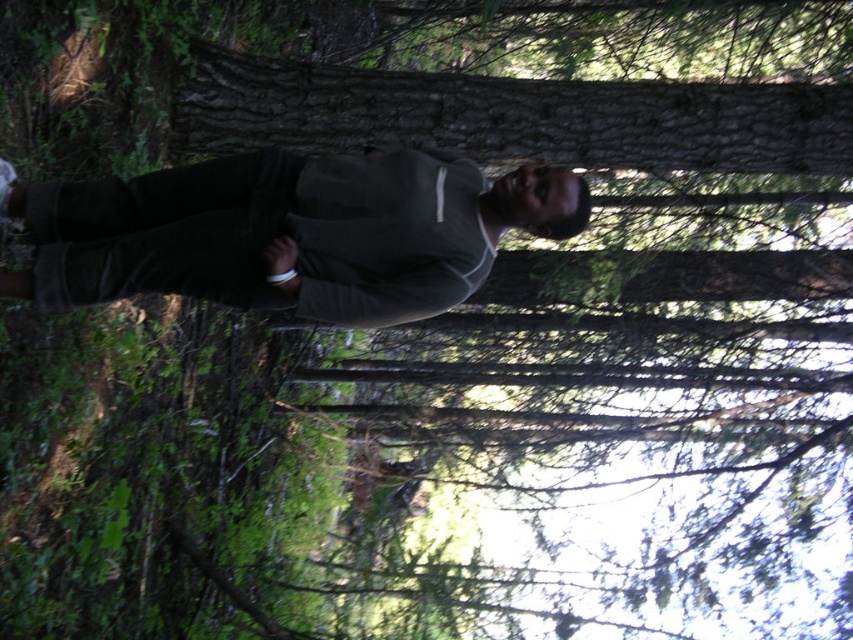
Based on the photo, you are a photographer trying to capture a closeup of the smooth brown bark at center. However, the gray matte sweater at center is blocking your view. Can you move the sweater to the side to get an unobstructed shot?

The gray matte sweater at center is in front of the smooth brown bark at center, so moving the sweater to the side would allow you to capture the smooth brown bark at center without obstruction.

Consider the image. You are a photographer standing 3 meters away from the camera position. You want to take a photo of the person in the wooded area. If the camera is at point 0,0, and your current position is at point 3,0, can you adjust your position to be closer to the person at point (x=421, y=259) without moving the camera?

The distance of point (x=421, y=259) from the camera is 2.86 meters. Since you are currently 3 meters away from the camera, you can move closer to the person by moving your position to be between 2.86 meters and 3 meters away from the camera, aligning towards the point (x=421, y=259). This adjustment would place you closer to the person without moving the camera itself.